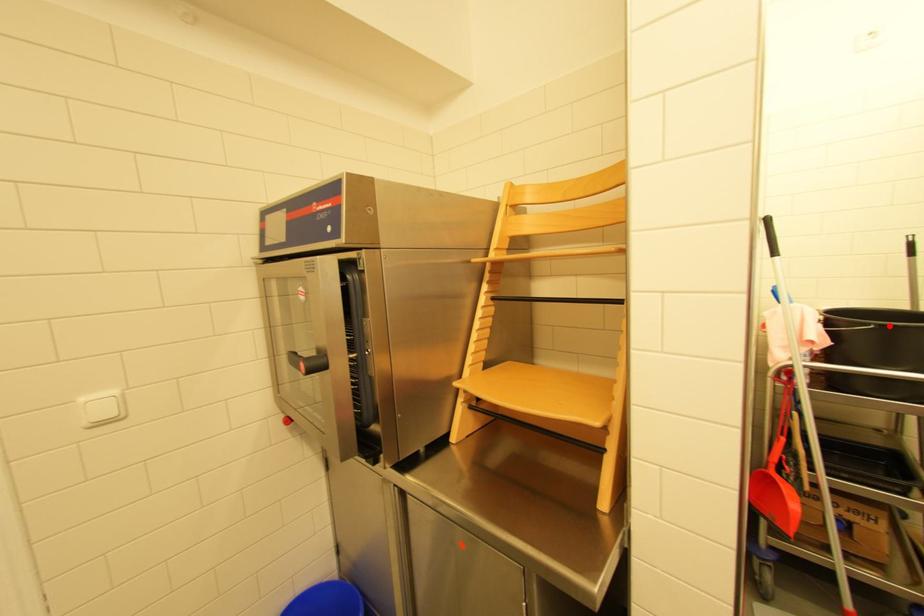
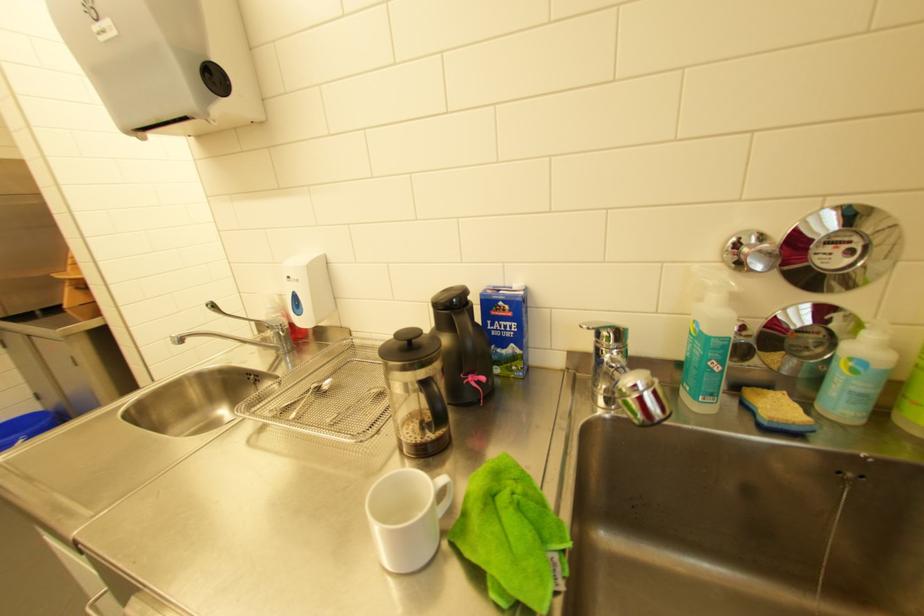
Question: I am providing you with two images of the same scene from different viewpoints. A red point is marked on the first image. Is the red point's position out of view in image 2?

Choices:
 (A) Yes
 (B) No

Answer: (A)